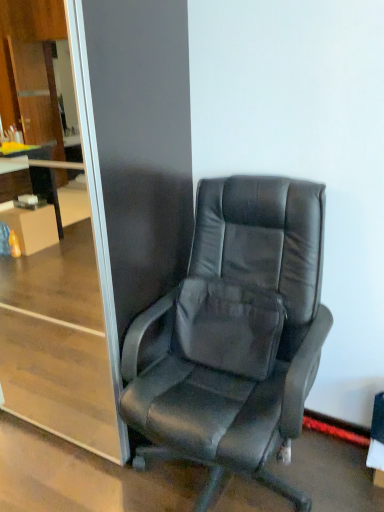
In order to face black leather chair at center, should I rotate leftwards or rightwards?

You should look right and rotate roughly 5.423 degrees.

This screenshot has height=512, width=384. What do you see at coordinates (236, 334) in the screenshot?
I see `black leather chair at center` at bounding box center [236, 334].

The image size is (384, 512). Find the location of `black leather chair at center`. black leather chair at center is located at coordinates [x=236, y=334].

What are the coordinates of `black leather chair at center` in the screenshot? It's located at (236, 334).